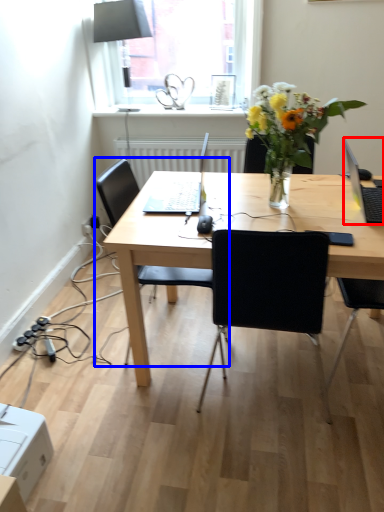
Question: Which point is further to the camera, laptop (highlighted by a red box) or chair (highlighted by a blue box)?

Choices:
 (A) laptop
 (B) chair

Answer: (B)